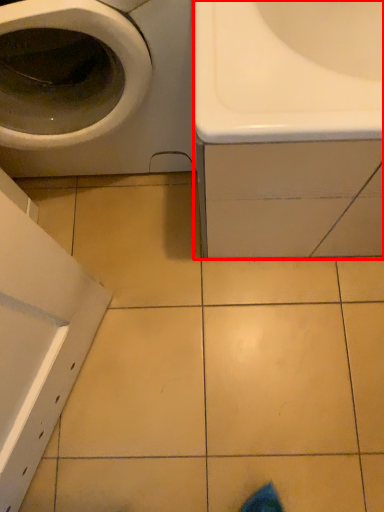
Question: From the image's perspective, what is the correct spatial relationship of sink (annotated by the red box) in relation to washing machine?

Choices:
 (A) below
 (B) above

Answer: (A)